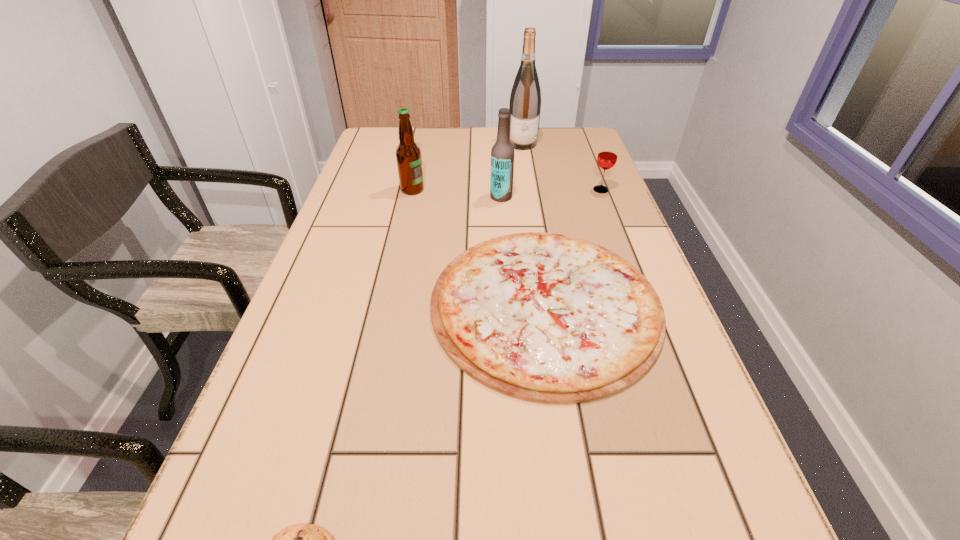
You are a GUI agent. You are given a task and a screenshot of the screen. Output one action in this format:
    pyautogui.click(x=<x>, y=<y>)
    Task: Click on the vacant space that satisfies the following two spatial constraints: 1. on the label of the right beer bottle; 2. on the left side of the fifth farthest object
    
    Given the screenshot: What is the action you would take?
    pyautogui.click(x=508, y=304)